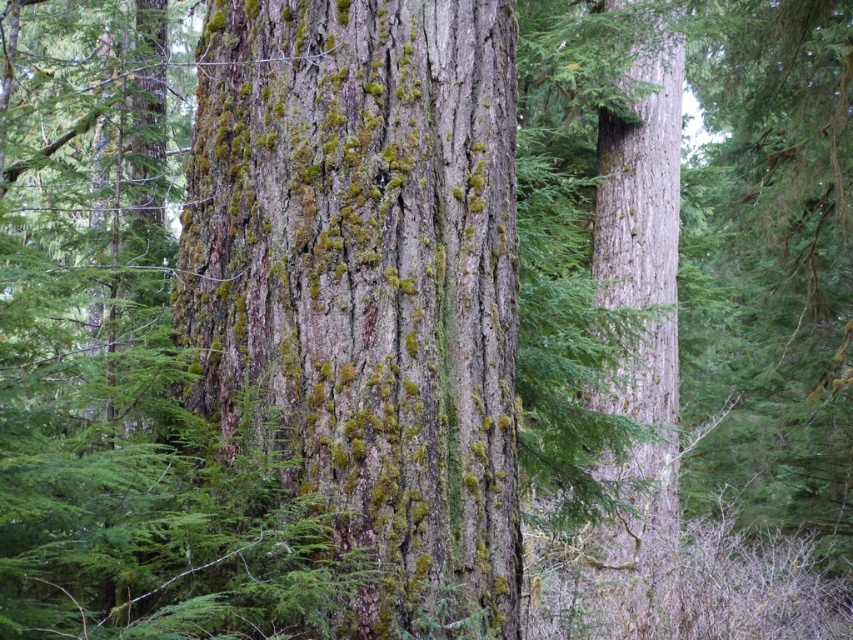
Based on the photo, who is shorter, green mossy bark at center or smooth gray bark at right?

Standing shorter between the two is smooth gray bark at right.

Which of these two, green mossy bark at center or smooth gray bark at right, stands taller?

green mossy bark at center is taller.

Between point (285, 38) and point (622, 369), which one is positioned in front?

Point (285, 38) is in front.

You are a GUI agent. You are given a task and a screenshot of the screen. Output one action in this format:
    pyautogui.click(x=<x>, y=<y>)
    Task: Click on the green mossy bark at center
    
    Given the screenshot: What is the action you would take?
    pos(369,280)